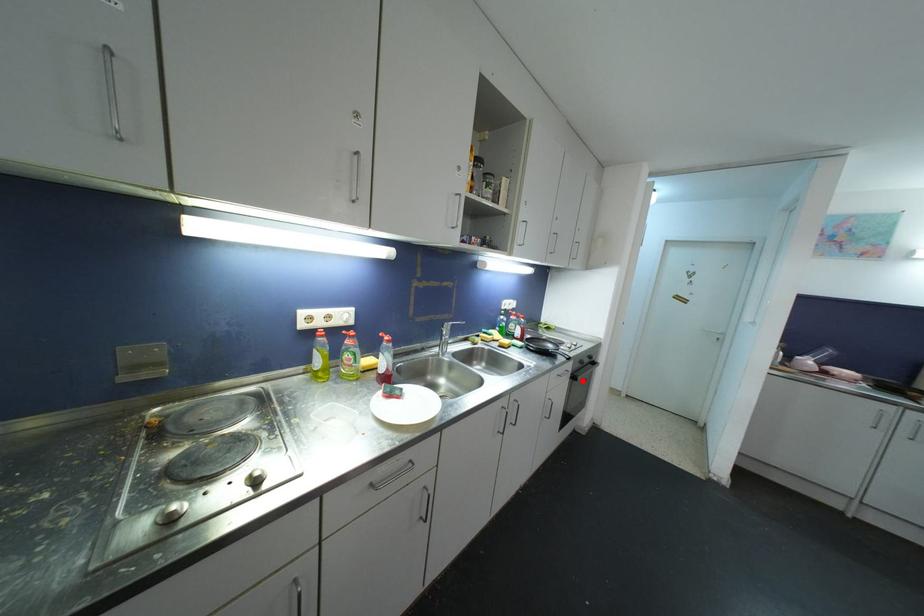
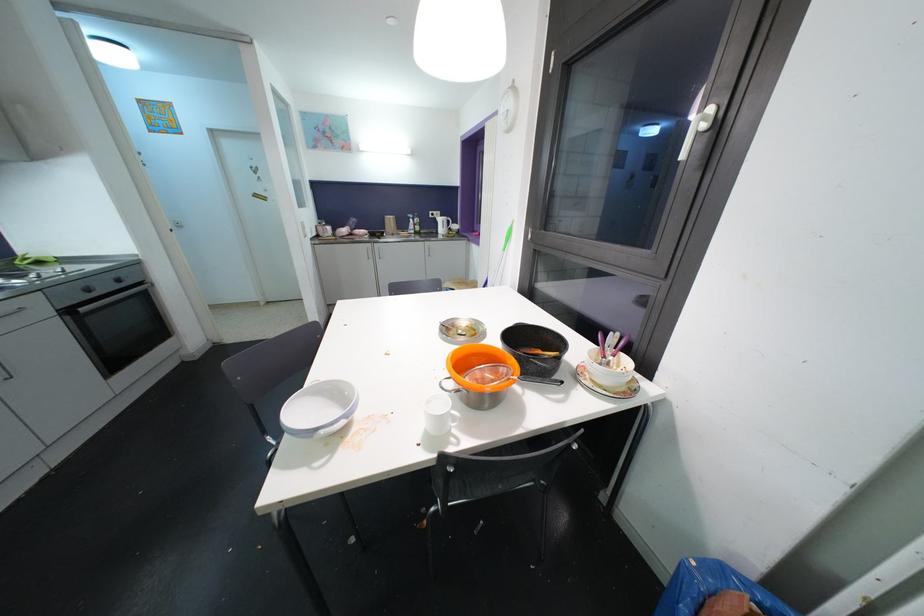
Find the pixel in the second image that matches the highlighted location in the first image.

(84, 312)